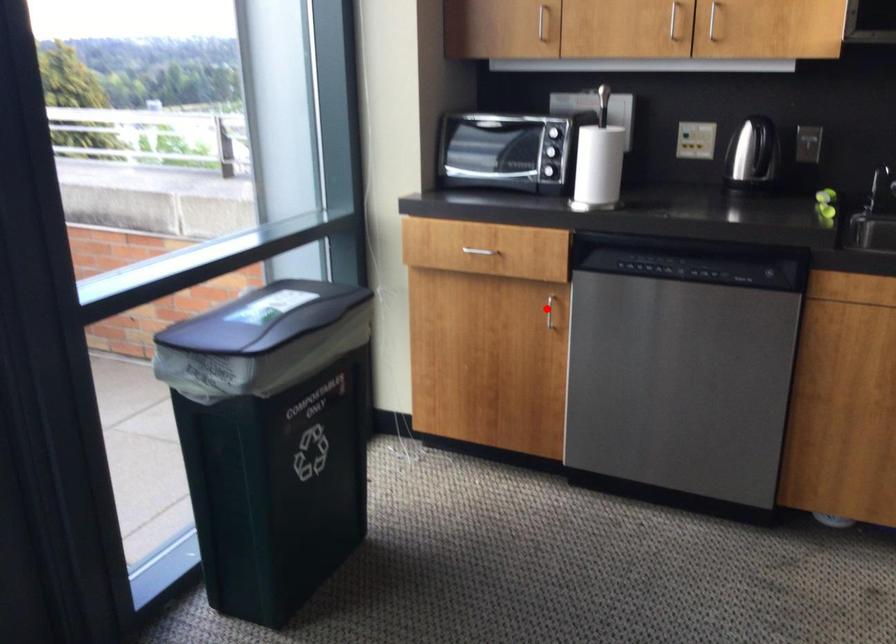
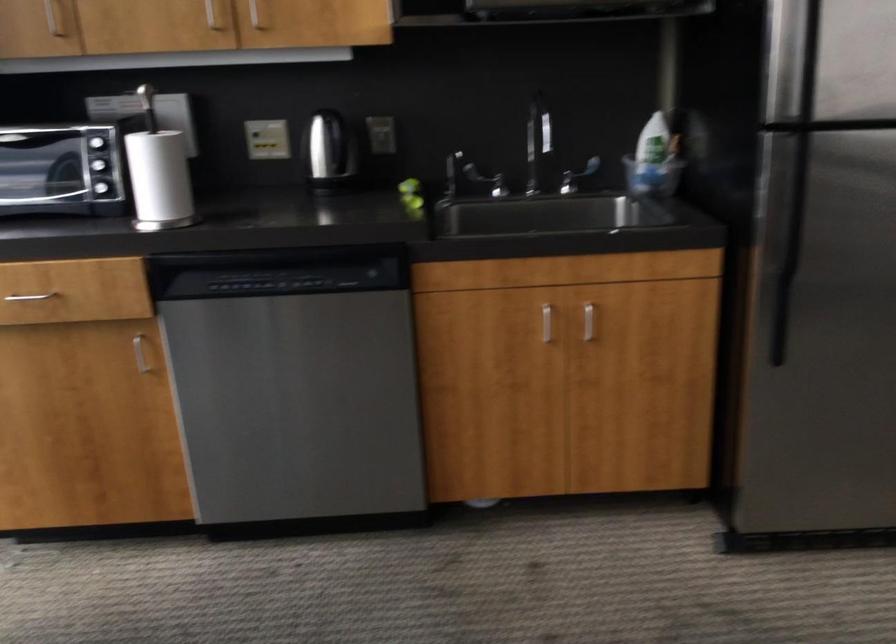
Question: I am providing you with two images of the same scene from different viewpoints. In image1, a red point is highlighted. Considering the same 3D point in image2, which of the following is correct?

Choices:
 (A) It is closer
 (B) It is farther

Answer: (A)